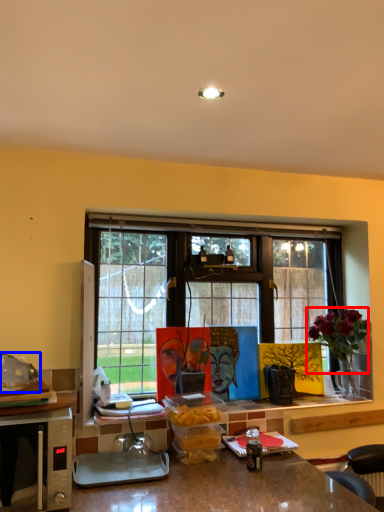
Question: Among these objects, which one is nearest to the camera, flower (highlighted by a red box) or food (highlighted by a blue box)?

Choices:
 (A) flower
 (B) food

Answer: (B)